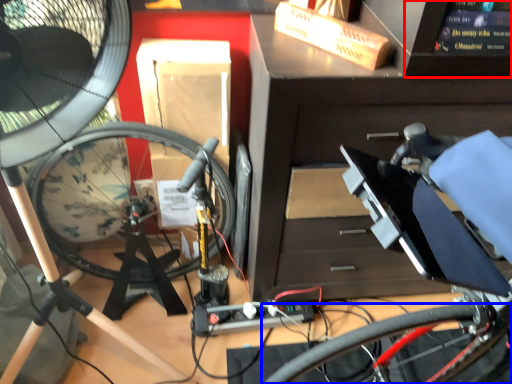
Question: Which of the following is the closest to the observer, computer screen (highlighted by a red box) or bicycle wheel (highlighted by a blue box)?

Choices:
 (A) computer screen
 (B) bicycle wheel

Answer: (A)